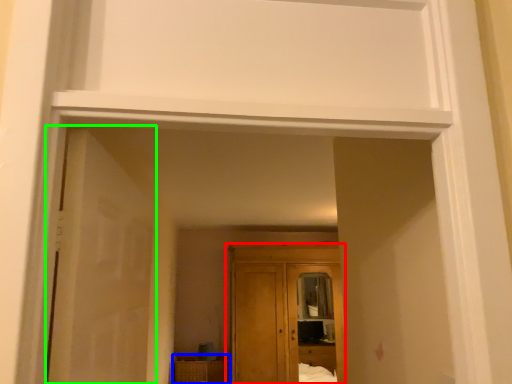
Question: Which object is the farthest from cupboard (highlighted by a red box)? Choose among these: cabinetry (highlighted by a blue box) or door (highlighted by a green box).

Choices:
 (A) cabinetry
 (B) door

Answer: (B)